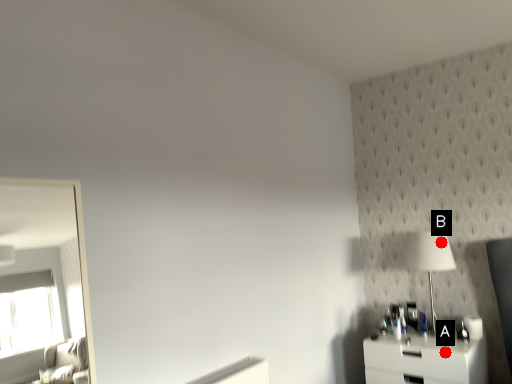
Question: Two points are circled on the image, labeled by A and B beside each circle. Which point is further to the camera?

Choices:
 (A) A is further
 (B) B is further

Answer: (B)